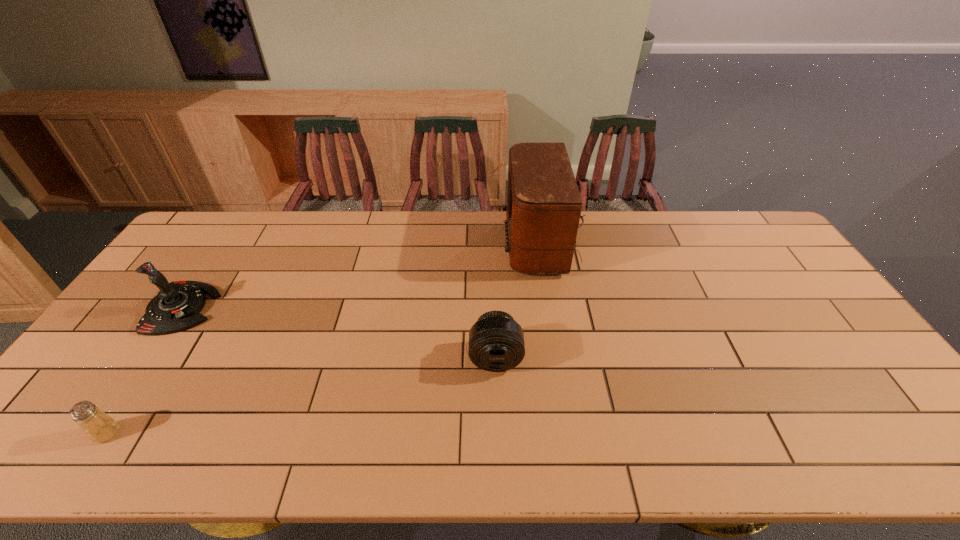
Identify the location of the tallest object. (543, 211).

Where is `radio receiver`? radio receiver is located at coordinates (543, 211).

This screenshot has height=540, width=960. I want to click on the third nearest object, so click(x=176, y=307).

At what (x,y) coordinates should I click in order to perform the action: click on the third shortest object. Please return your answer as a coordinate pair (x, y). Looking at the image, I should click on (176, 307).

This screenshot has height=540, width=960. What are the coordinates of `the third farthest object` in the screenshot? It's located at (496, 341).

This screenshot has width=960, height=540. Find the location of `the third tallest object`. the third tallest object is located at coordinates (496, 341).

Identify the location of the shortest object. (100, 427).

Locate an element on the screen. saltshaker is located at coordinates (100, 427).

You are a GUI agent. You are given a task and a screenshot of the screen. Output one action in this format:
    pyautogui.click(x=<x>, y=<y>)
    Task: Click on the free space located 0.160m on the front panel of the tallest object
    The height and width of the screenshot is (540, 960).
    Given the screenshot: What is the action you would take?
    pyautogui.click(x=456, y=243)

Locate an element on the screen. The width and height of the screenshot is (960, 540). free space located on the front panel of the tallest object is located at coordinates (396, 243).